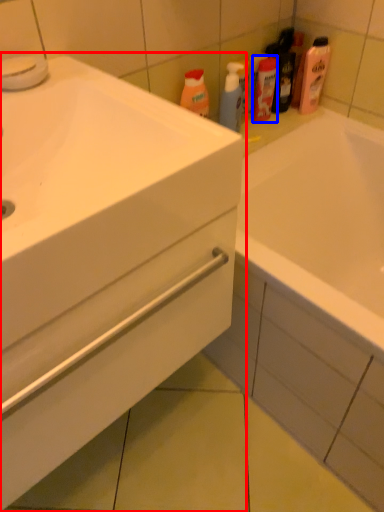
Question: Which of the following is the farthest to the observer, bathroom cabinet (highlighted by a red box) or mouthwash (highlighted by a blue box)?

Choices:
 (A) bathroom cabinet
 (B) mouthwash

Answer: (B)